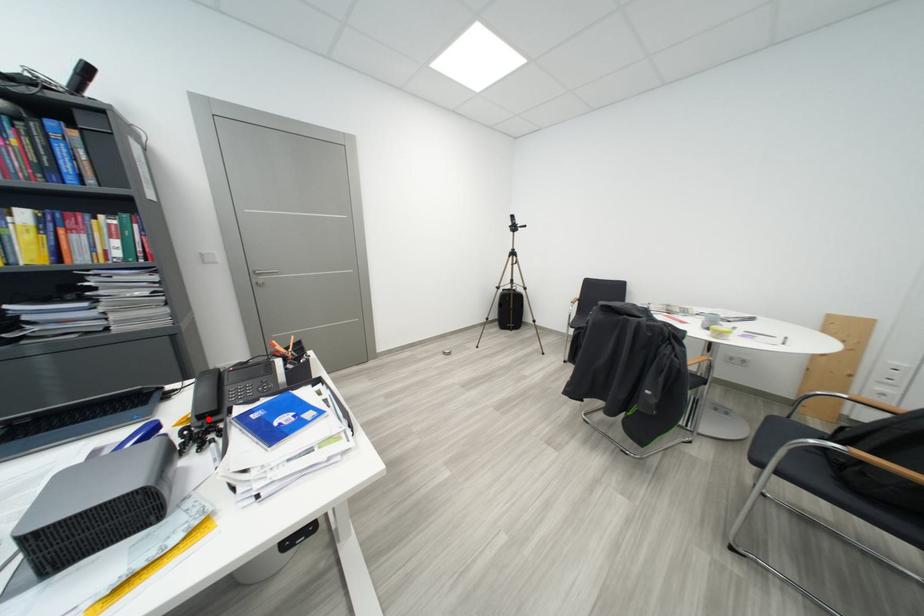
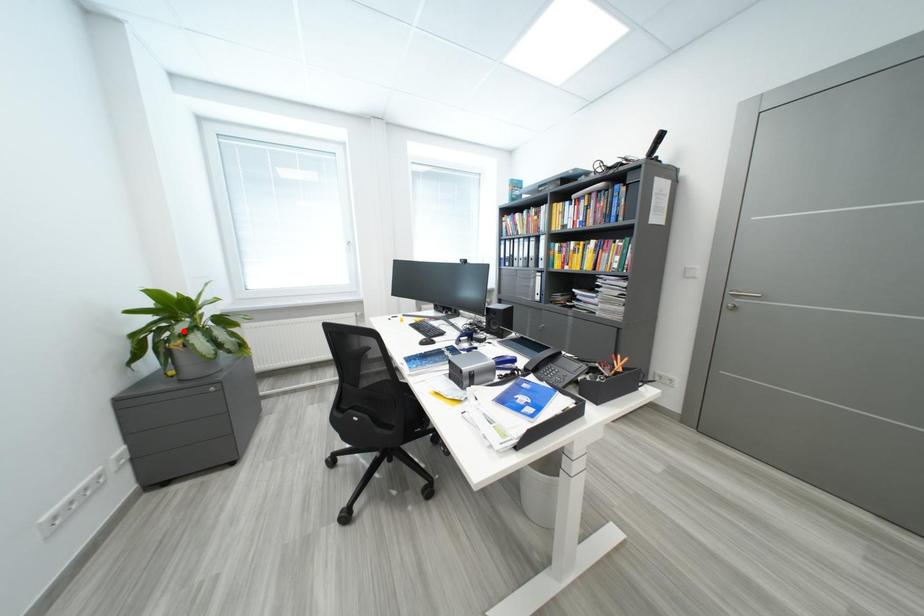
I am providing you with two images of the same scene from different viewpoints. A red point is marked on the first image and another point is marked on the second image. Do the highlighted points in image1 and image2 indicate the same real-world spot?

No